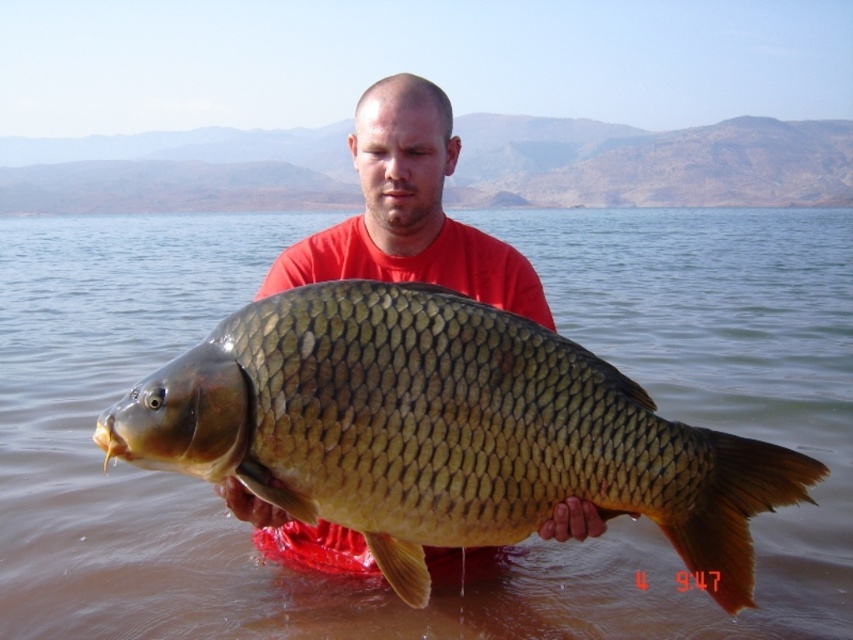
Question: Considering the relative positions of shiny gold scales at center and matte gold fish at center in the image provided, where is shiny gold scales at center located with respect to matte gold fish at center?

Choices:
 (A) left
 (B) right

Answer: (B)

Question: Which of the following is the closest to the observer?

Choices:
 (A) (256, 408)
 (B) (262, 522)

Answer: (A)

Question: Which object is farther from the camera taking this photo?

Choices:
 (A) shiny gold scales at center
 (B) matte gold fish at center

Answer: (B)

Question: Does shiny gold scales at center appear on the left side of matte gold fish at center?

Choices:
 (A) yes
 (B) no

Answer: (B)

Question: Does shiny gold scales at center appear on the left side of matte gold fish at center?

Choices:
 (A) yes
 (B) no

Answer: (B)